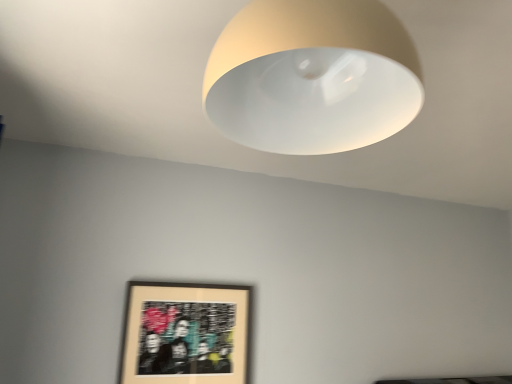
Question: Considering their positions, is matte black picture frame at lower left located in front of or behind matte white lampshade at upper center?

Choices:
 (A) behind
 (B) front

Answer: (A)

Question: Based on their sizes in the image, would you say matte black picture frame at lower left is bigger or smaller than matte white lampshade at upper center?

Choices:
 (A) big
 (B) small

Answer: (B)

Question: From a real-world perspective, is matte black picture frame at lower left above or below matte white lampshade at upper center?

Choices:
 (A) below
 (B) above

Answer: (A)

Question: Is matte white lampshade at upper center inside the boundaries of matte black picture frame at lower left, or outside?

Choices:
 (A) inside
 (B) outside

Answer: (B)

Question: From their relative heights in the image, would you say matte white lampshade at upper center is taller or shorter than matte black picture frame at lower left?

Choices:
 (A) short
 (B) tall

Answer: (A)

Question: Is point (387, 87) closer or farther from the camera than point (236, 372)?

Choices:
 (A) farther
 (B) closer

Answer: (B)

Question: From a real-world perspective, is matte white lampshade at upper center positioned above or below matte black picture frame at lower left?

Choices:
 (A) above
 (B) below

Answer: (A)